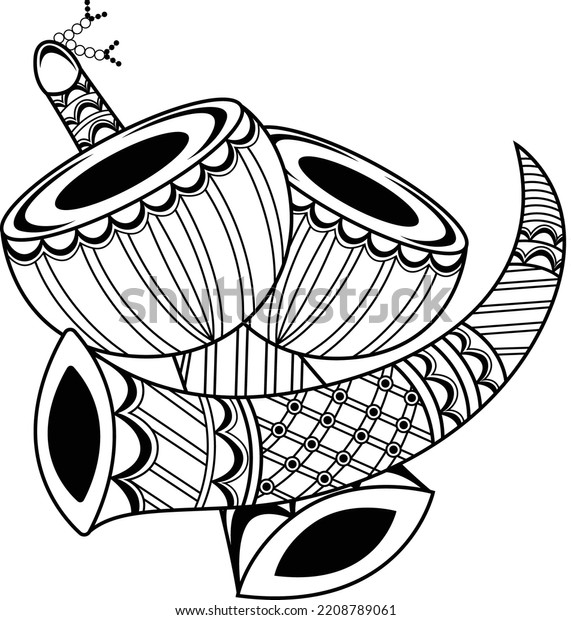
The width and height of the screenshot is (571, 620). In order to click on bowls in this screenshot , I will do tap(156, 205), tap(347, 280).